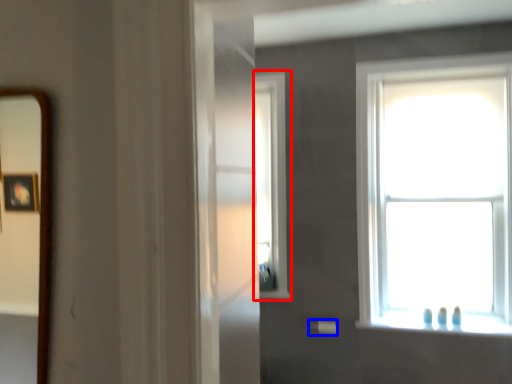
Question: Among these objects, which one is farthest to the camera, window (highlighted by a red box) or towel bar (highlighted by a blue box)?

Choices:
 (A) window
 (B) towel bar

Answer: (A)